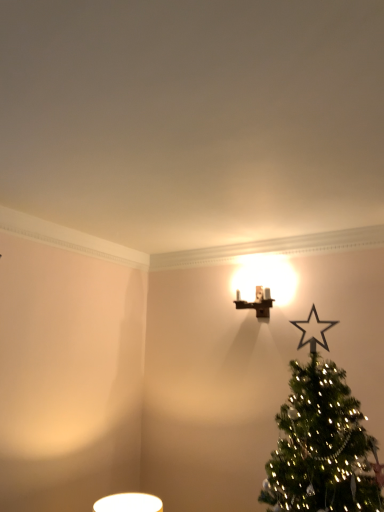
At what (x,y) coordinates should I click in order to perform the action: click on metallic gold sconce at upper center. Please return your answer as a coordinate pair (x, y). The width and height of the screenshot is (384, 512). Looking at the image, I should click on (257, 303).

This screenshot has width=384, height=512. Describe the element at coordinates (257, 303) in the screenshot. I see `metallic gold sconce at upper center` at that location.

The height and width of the screenshot is (512, 384). What are the coordinates of `metallic gold sconce at upper center` in the screenshot? It's located at (257, 303).